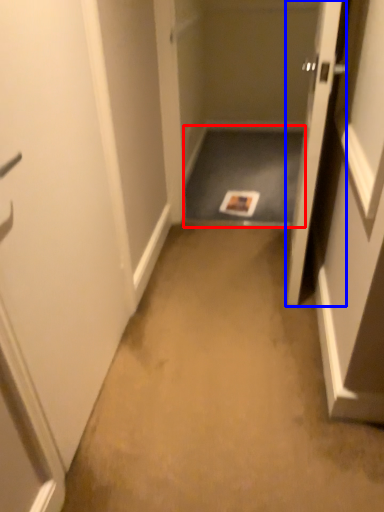
Question: Which point is further to the camera, corridor (highlighted by a red box) or door (highlighted by a blue box)?

Choices:
 (A) corridor
 (B) door

Answer: (A)